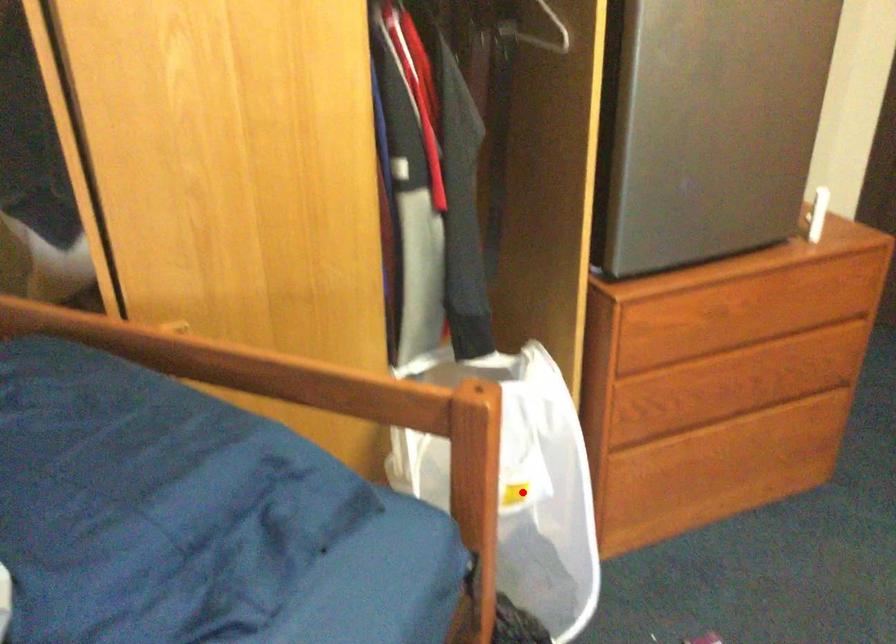
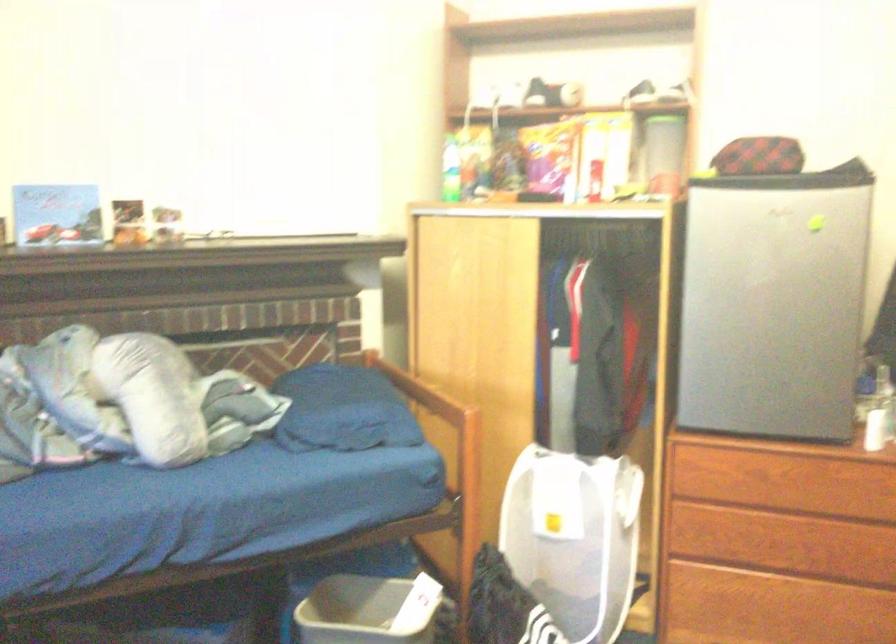
Question: I am providing you with two images of the same scene from different viewpoints. Image1 has a red point marked. In image2, the corresponding 3D location appears at what relative position? Reply with the corresponding letter.

Choices:
 (A) Closer
 (B) Farther

Answer: (B)